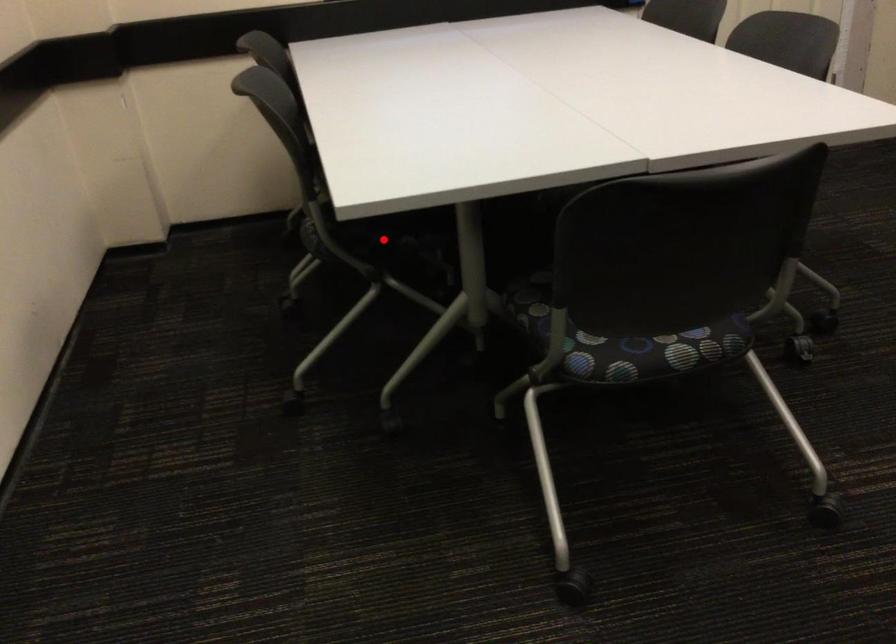
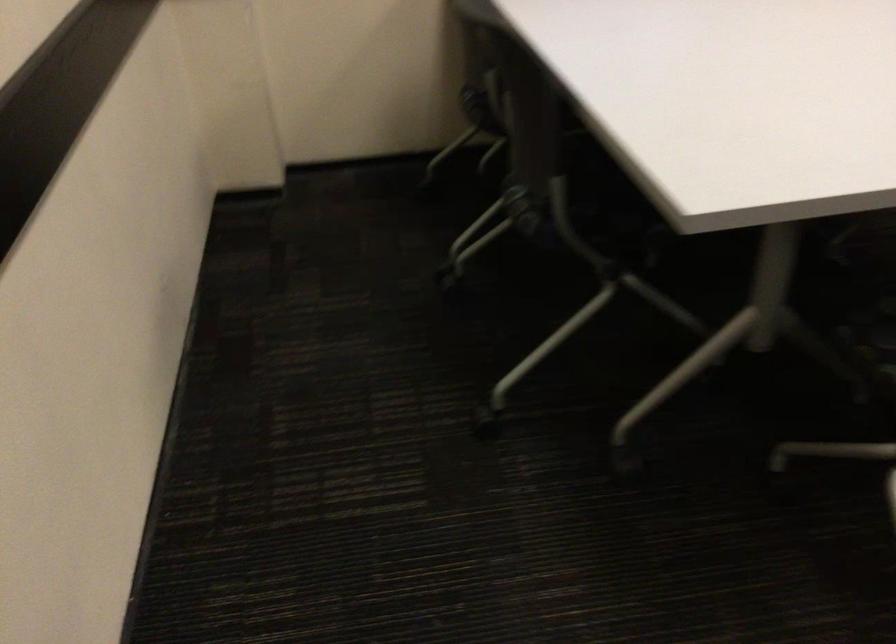
In the second image, find the point that corresponds to the highlighted location in the first image.

(619, 227)